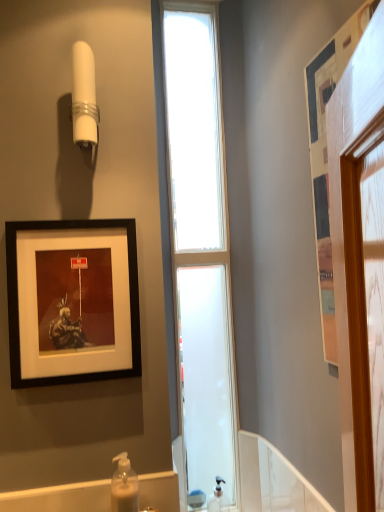
Question: Is translucent plastic soap dispenser at lower center, the 2th soap dispenser in the right-to-left sequence, behind clear plastic soap dispenser at lower center, the 1th soap dispenser when ordered from back to front?

Choices:
 (A) no
 (B) yes

Answer: (A)

Question: Does translucent plastic soap dispenser at lower center, the 1th soap dispenser from the top, have a smaller size compared to clear plastic soap dispenser at lower center, arranged as the first soap dispenser when viewed from the right?

Choices:
 (A) no
 (B) yes

Answer: (A)

Question: Is translucent plastic soap dispenser at lower center, the 2th soap dispenser in the right-to-left sequence, oriented towards clear plastic soap dispenser at lower center, the 2th soap dispenser viewed from the left?

Choices:
 (A) yes
 (B) no

Answer: (B)

Question: Is translucent plastic soap dispenser at lower center, the 1th soap dispenser from the top, thinner than clear plastic soap dispenser at lower center, the 1th soap dispenser when ordered from back to front?

Choices:
 (A) no
 (B) yes

Answer: (A)

Question: Are translucent plastic soap dispenser at lower center, which is the 2th soap dispenser in bottom-to-top order, and clear plastic soap dispenser at lower center, which is counted as the second soap dispenser, starting from the top, far apart?

Choices:
 (A) no
 (B) yes

Answer: (A)

Question: Considering the positions of clear glass window at center and black matte picture frame at upper left, the 2th picture frame when ordered from right to left, in the image, is clear glass window at center wider or thinner than black matte picture frame at upper left, the 2th picture frame when ordered from right to left,?

Choices:
 (A) wide
 (B) thin

Answer: (A)

Question: Does point (192, 192) appear closer or farther from the camera than point (92, 318)?

Choices:
 (A) farther
 (B) closer

Answer: (A)

Question: Would you say clear glass window at center is inside or outside black matte picture frame at upper left, the 2th picture frame when ordered from right to left?

Choices:
 (A) outside
 (B) inside

Answer: (A)

Question: Is clear glass window at center taller or shorter than black matte picture frame at upper left, the 1th picture frame when ordered from back to front?

Choices:
 (A) short
 (B) tall

Answer: (B)

Question: Is point coord(135,238) positioned closer to the camera than point coord(319,222)?

Choices:
 (A) farther
 (B) closer

Answer: (A)

Question: From their relative heights in the image, would you say black matte picture frame at upper left, which ranks as the 2th picture frame in front-to-back order, is taller or shorter than wooden framed picture at right, the 2th picture frame when ordered from back to front?

Choices:
 (A) tall
 (B) short

Answer: (B)

Question: Is black matte picture frame at upper left, which ranks as the 2th picture frame in front-to-back order, in front of or behind wooden framed picture at right, arranged as the 2th picture frame when viewed from the left, in the image?

Choices:
 (A) behind
 (B) front

Answer: (A)

Question: Visually, is black matte picture frame at upper left, the 1th picture frame when ordered from back to front, positioned to the left or to the right of wooden framed picture at right, the 2th picture frame when ordered from back to front?

Choices:
 (A) left
 (B) right

Answer: (A)

Question: Which is correct: clear glass window at center is inside white plastic shower at upper left, or outside of it?

Choices:
 (A) outside
 (B) inside

Answer: (A)

Question: Based on their positions, is clear glass window at center located to the left or right of white plastic shower at upper left?

Choices:
 (A) right
 (B) left

Answer: (A)